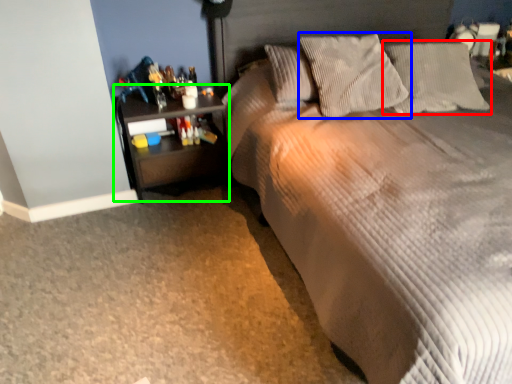
Question: Which object is the closest to the pillow (highlighted by a red box)? Choose among these: pillow (highlighted by a blue box) or nightstand (highlighted by a green box).

Choices:
 (A) pillow
 (B) nightstand

Answer: (A)